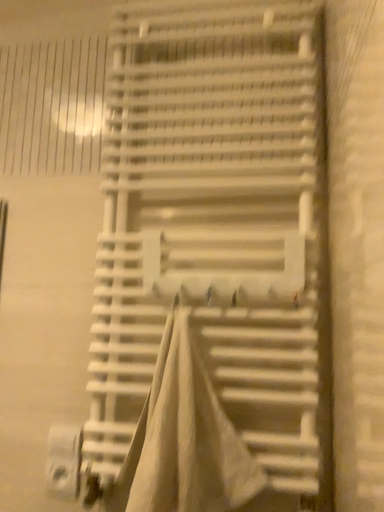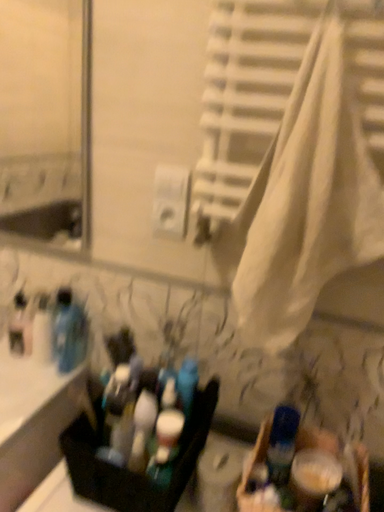
Question: How did the camera likely rotate when shooting the video?

Choices:
 (A) rotated right
 (B) rotated left

Answer: (B)